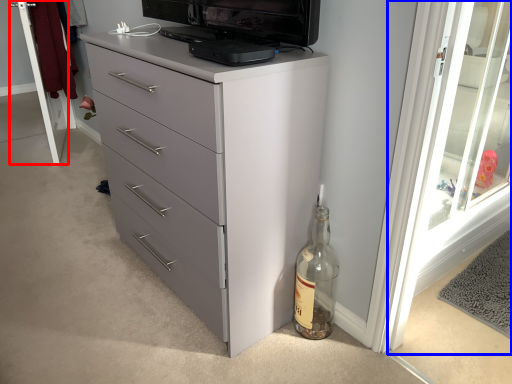
Question: Among these objects, which one is farthest to the camera, screen door (highlighted by a red box) or screen door (highlighted by a blue box)?

Choices:
 (A) screen door
 (B) screen door

Answer: (A)